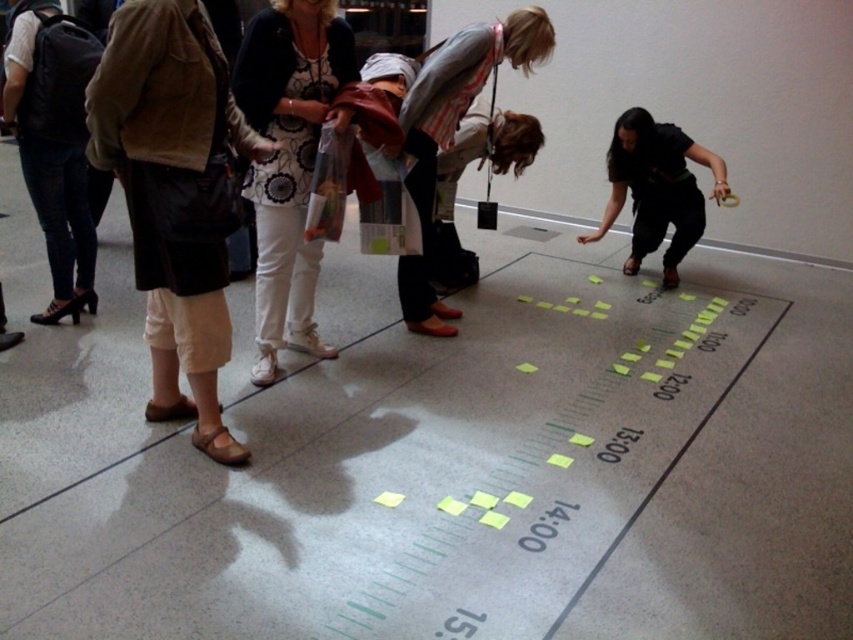
From the picture: Does white cotton pants at center appear under striped fabric shirt at center?

Indeed, white cotton pants at center is positioned under striped fabric shirt at center.

Which is behind, point (308, 291) or point (502, 33)?

The point (308, 291) is behind.

Locate an element on the screen. This screenshot has height=640, width=853. white cotton pants at center is located at coordinates (289, 161).